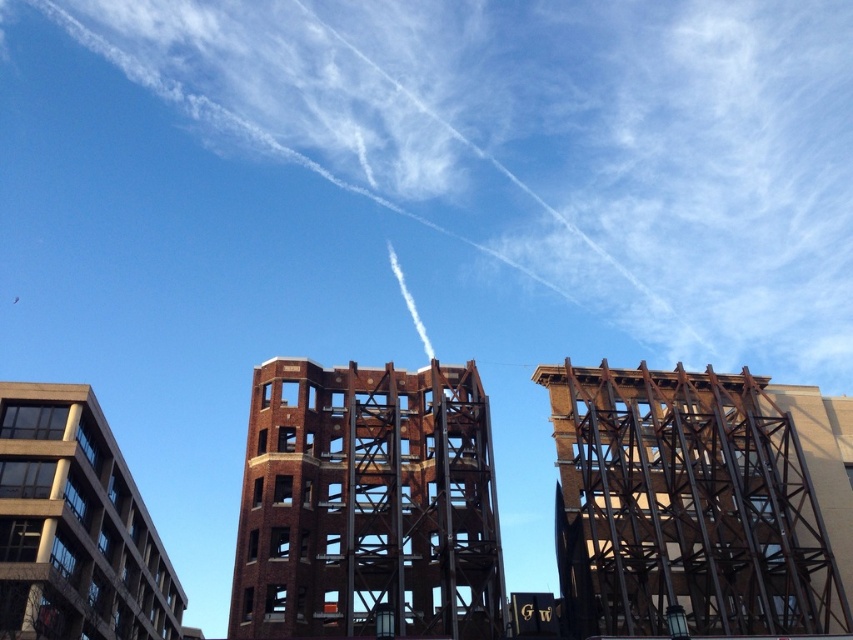
Who is higher up, rusty metal scaffolding at center or brown brick tower at center?

brown brick tower at center

Does rusty metal scaffolding at center come in front of brown brick tower at center?

No, rusty metal scaffolding at center is behind brown brick tower at center.

Between point (566, 612) and point (397, 380), which one is positioned in front?

Point (566, 612) is more forward.

Where is `rusty metal scaffolding at center`? The width and height of the screenshot is (853, 640). rusty metal scaffolding at center is located at coordinates (685, 506).

Is point (311, 458) behind point (6, 632)?

Yes, it is.

Is point (444, 534) farther from camera compared to point (108, 472)?

No, (444, 534) is in front of (108, 472).

The width and height of the screenshot is (853, 640). I want to click on brown brick tower at center, so click(367, 504).

Does point (646, 582) come in front of point (90, 435)?

Yes, it is.

Between rusty metal scaffolding at center and gray concrete building at left, which one is positioned lower?

gray concrete building at left is below.

Between point (643, 424) and point (57, 477), which one is positioned in front?

Point (57, 477) is in front.

I want to click on rusty metal scaffolding at center, so click(x=685, y=506).